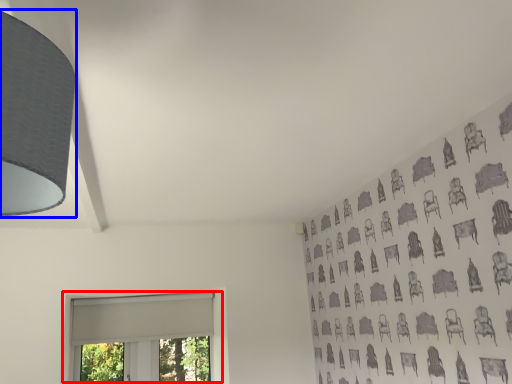
Question: Which object is closer to the camera taking this photo, window (highlighted by a red box) or lamp (highlighted by a blue box)?

Choices:
 (A) window
 (B) lamp

Answer: (B)